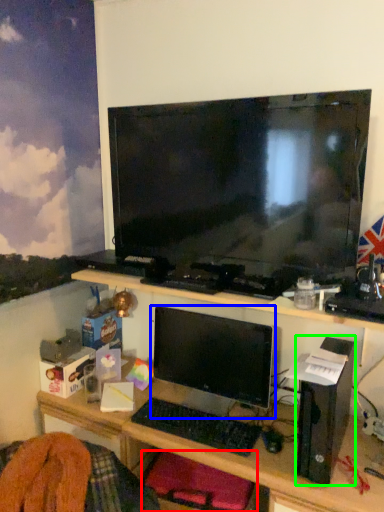
Question: Estimate the real-world distances between objects in this image. Which object is farther from computer chair (highlighted by a red box), computer monitor (highlighted by a blue box) or computer (highlighted by a green box)?

Choices:
 (A) computer monitor
 (B) computer

Answer: (B)